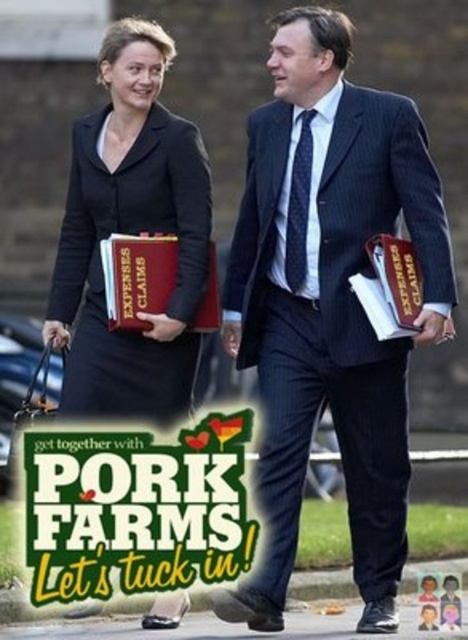
Who is more forward, (x=105, y=38) or (x=153, y=483)?

Point (x=153, y=483) is more forward.

Is black matte suit at center taller than green paper poster at center?

Correct, black matte suit at center is much taller as green paper poster at center.

Between point (71, 243) and point (115, 461), which one is positioned in front?

Positioned in front is point (115, 461).

Where is `black matte suit at center`? The height and width of the screenshot is (640, 468). black matte suit at center is located at coordinates (131, 234).

Which of these two, black matte suit at center or matte brown leather book at center, stands shorter?

With less height is matte brown leather book at center.

Looking at this image, is black matte suit at center below matte brown leather book at center?

No.

Is point (185, 387) in front of point (134, 259)?

No, (185, 387) is further to viewer.

Identify the location of black matte suit at center. This screenshot has width=468, height=640. (131, 234).

Between point (389, 504) and point (182, 438), which one is positioned behind?

The point (389, 504) is behind.

Consider the image. Is dark blue pinstripe suit at center behind green paper poster at center?

Yes, it is behind green paper poster at center.

Find the location of a particular element. This screenshot has width=468, height=640. dark blue pinstripe suit at center is located at coordinates (329, 304).

You are a GUI agent. You are given a task and a screenshot of the screen. Output one action in this format:
    pyautogui.click(x=<x>, y=<y>)
    Task: Click on the dark blue pinstripe suit at center
    
    Given the screenshot: What is the action you would take?
    pyautogui.click(x=329, y=304)